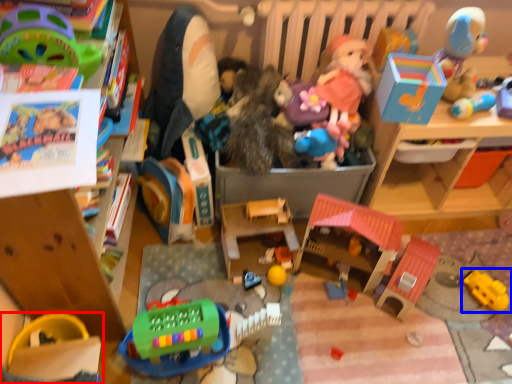
Question: Which object is further to the camera taking this photo, toy (highlighted by a red box) or toy (highlighted by a blue box)?

Choices:
 (A) toy
 (B) toy

Answer: (B)